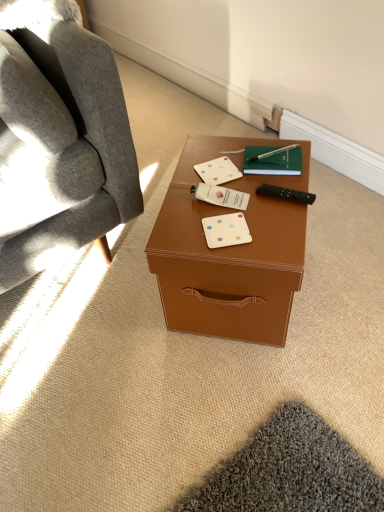
The height and width of the screenshot is (512, 384). I want to click on vacant area that lies to the right of white matte business card at center, marked as the 2th business card in a back-to-front arrangement, so click(x=269, y=198).